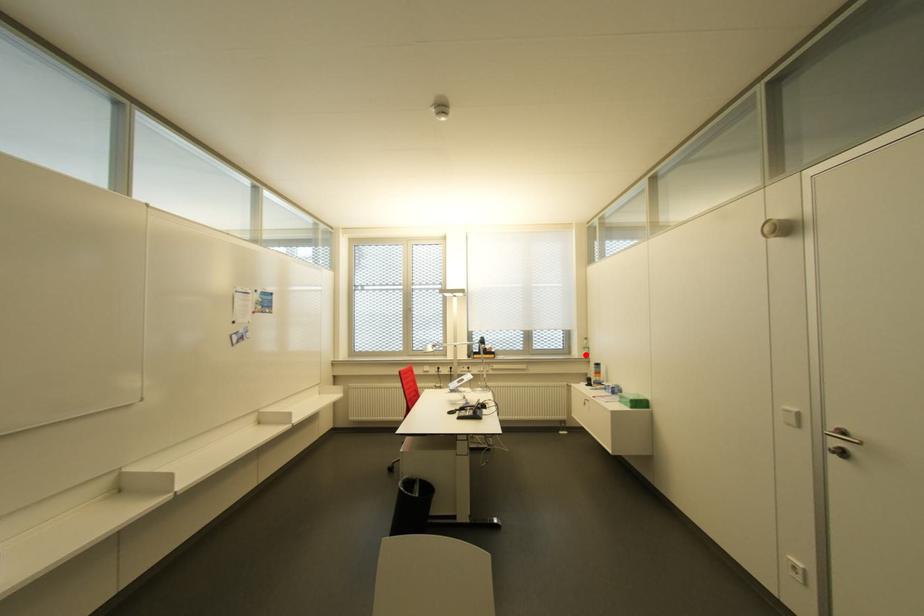
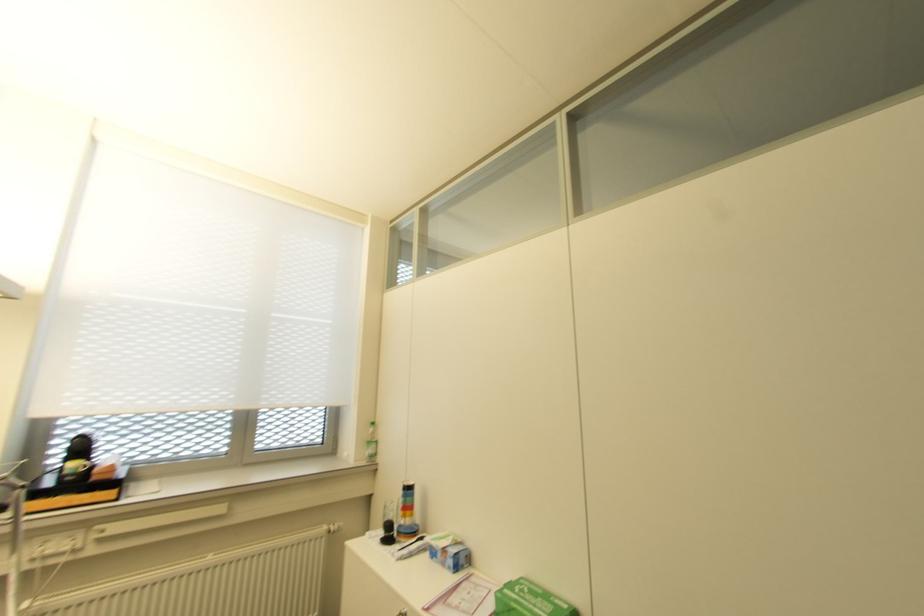
Find the pixel in the second image that matches the highlighted location in the first image.

(372, 455)